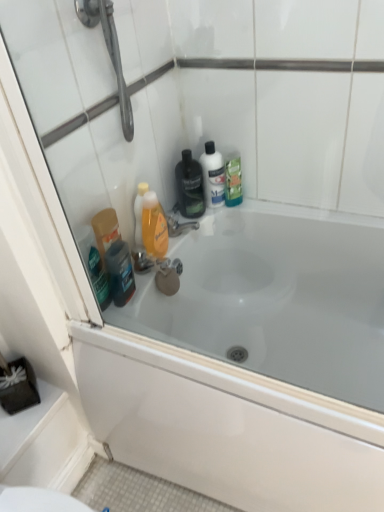
Question: Is metallic chrome faucet at center aimed at white glossy mouthwash at center, arranged as the 2th mouthwash when viewed from the right?

Choices:
 (A) no
 (B) yes

Answer: (A)

Question: Can you confirm if metallic chrome faucet at center is smaller than white glossy mouthwash at center, arranged as the 2th mouthwash when viewed from the right?

Choices:
 (A) yes
 (B) no

Answer: (A)

Question: Considering the relative positions of metallic chrome faucet at center and white glossy mouthwash at center, the 3th mouthwash when ordered from left to right, in the image provided, is metallic chrome faucet at center behind white glossy mouthwash at center, the 3th mouthwash when ordered from left to right,?

Choices:
 (A) yes
 (B) no

Answer: (B)

Question: Is white glossy mouthwash at center, arranged as the 2th mouthwash when viewed from the right, inside metallic chrome faucet at center?

Choices:
 (A) yes
 (B) no

Answer: (B)

Question: Is metallic chrome faucet at center thinner than white glossy mouthwash at center, the 3th mouthwash when ordered from left to right?

Choices:
 (A) yes
 (B) no

Answer: (B)

Question: Is translucent plastic mouthwash at upper right, which is counted as the 4th mouthwash, starting from the left, taller or shorter than shiny dark blue bottle at lower left?

Choices:
 (A) short
 (B) tall

Answer: (B)

Question: Do you think translucent plastic mouthwash at upper right, the 1th mouthwash from the right, is within shiny dark blue bottle at lower left, or outside of it?

Choices:
 (A) outside
 (B) inside

Answer: (A)

Question: Is point (228, 204) positioned closer to the camera than point (122, 279)?

Choices:
 (A) closer
 (B) farther

Answer: (B)

Question: In terms of width, does translucent plastic mouthwash at upper right, which is counted as the 4th mouthwash, starting from the left, look wider or thinner when compared to shiny dark blue bottle at lower left?

Choices:
 (A) wide
 (B) thin

Answer: (A)

Question: In terms of width, does translucent orange liquid at center, which is the fourth mouthwash from right to left, look wider or thinner when compared to white glossy bathtub at upper center?

Choices:
 (A) thin
 (B) wide

Answer: (A)

Question: Is translucent orange liquid at center, which is the fourth mouthwash from right to left, taller or shorter than white glossy bathtub at upper center?

Choices:
 (A) short
 (B) tall

Answer: (A)

Question: Relative to white glossy bathtub at upper center, is translucent orange liquid at center, the first mouthwash from the left, in front or behind?

Choices:
 (A) behind
 (B) front

Answer: (A)

Question: Is translucent orange liquid at center, which is the fourth mouthwash from right to left, inside or outside of white glossy bathtub at upper center?

Choices:
 (A) inside
 (B) outside

Answer: (B)

Question: Is translucent plastic mouthwash at upper right, the 1th mouthwash from the right, taller or shorter than metallic chrome faucet at center?

Choices:
 (A) short
 (B) tall

Answer: (B)

Question: From the image's perspective, is translucent plastic mouthwash at upper right, which is counted as the 4th mouthwash, starting from the left, positioned above or below metallic chrome faucet at center?

Choices:
 (A) above
 (B) below

Answer: (A)